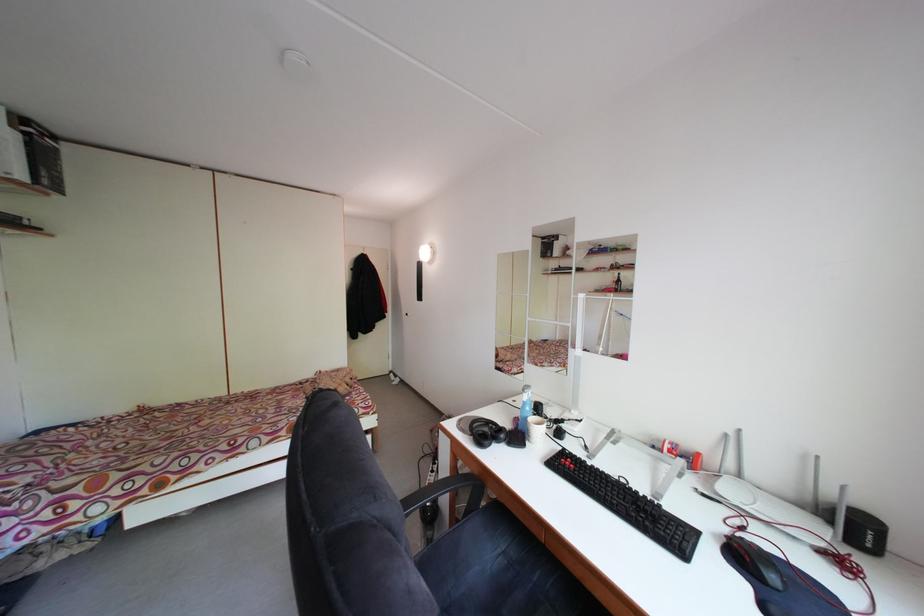
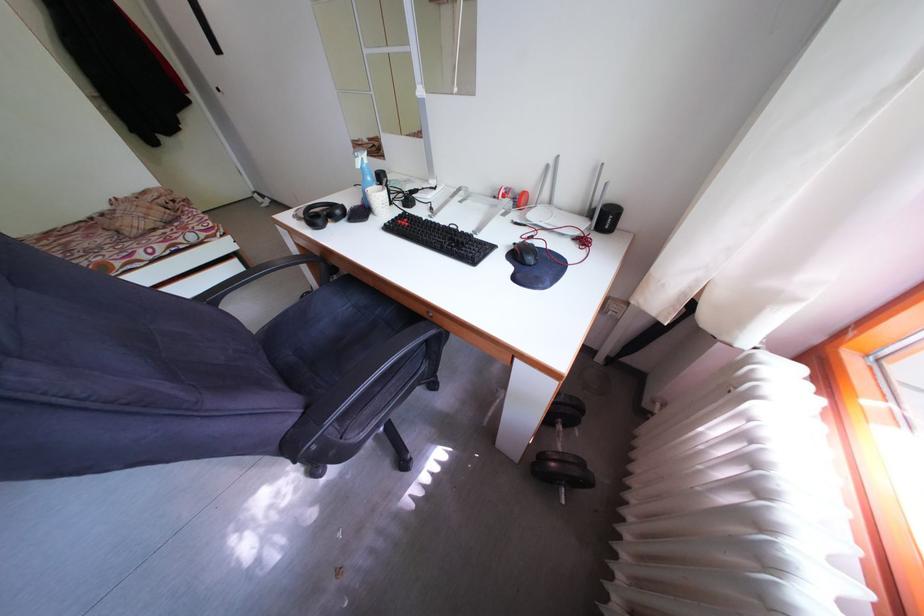
Find the pixel in the second image that matches [735,442] in the first image.

(555, 172)